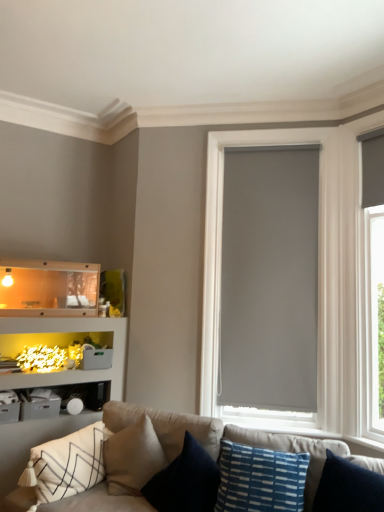
Question: Should I look upward or downward to see soft beige fabric couch at lower center?

Choices:
 (A) up
 (B) down

Answer: (B)

Question: Would you say dark blue textured pillow at center, positioned as the 2th pillow in left-to-right order, is a long distance from white textured pillow at lower left, positioned as the 3th pillow in right-to-left order?

Choices:
 (A) yes
 (B) no

Answer: (B)

Question: Considering the relative positions of dark blue textured pillow at center, positioned as the 2th pillow in left-to-right order, and white textured pillow at lower left, positioned as the 3th pillow in right-to-left order, in the image provided, is dark blue textured pillow at center, positioned as the 2th pillow in left-to-right order, to the right of white textured pillow at lower left, positioned as the 3th pillow in right-to-left order, from the viewer's perspective?

Choices:
 (A) no
 (B) yes

Answer: (B)

Question: Can you confirm if dark blue textured pillow at center, positioned as the 2th pillow in left-to-right order, is shorter than white textured pillow at lower left, which is counted as the first pillow, starting from the left?

Choices:
 (A) no
 (B) yes

Answer: (A)

Question: Is dark blue textured pillow at center, which is counted as the second pillow, starting from the right, at the left side of white textured pillow at lower left, positioned as the 3th pillow in right-to-left order?

Choices:
 (A) yes
 (B) no

Answer: (B)

Question: From a real-world perspective, is dark blue textured pillow at center, which is counted as the second pillow, starting from the right, on top of white textured pillow at lower left, positioned as the 3th pillow in right-to-left order?

Choices:
 (A) no
 (B) yes

Answer: (B)

Question: Is the position of dark blue textured pillow at center, positioned as the 2th pillow in left-to-right order, less distant than that of white textured pillow at lower left, positioned as the 3th pillow in right-to-left order?

Choices:
 (A) yes
 (B) no

Answer: (A)

Question: Does translucent plastic shelf at lower left turn towards white textured pillow at lower left, which is counted as the first pillow, starting from the left?

Choices:
 (A) yes
 (B) no

Answer: (B)

Question: Does translucent plastic shelf at lower left touch white textured pillow at lower left, positioned as the 3th pillow in right-to-left order?

Choices:
 (A) yes
 (B) no

Answer: (B)

Question: Does translucent plastic shelf at lower left have a lesser width compared to white textured pillow at lower left, positioned as the 3th pillow in right-to-left order?

Choices:
 (A) no
 (B) yes

Answer: (B)

Question: Is translucent plastic shelf at lower left taller than white textured pillow at lower left, which is counted as the first pillow, starting from the left?

Choices:
 (A) yes
 (B) no

Answer: (B)

Question: Can you confirm if translucent plastic shelf at lower left is positioned to the left of white textured pillow at lower left, positioned as the 3th pillow in right-to-left order?

Choices:
 (A) yes
 (B) no

Answer: (A)

Question: Is translucent plastic shelf at lower left located outside white textured pillow at lower left, positioned as the 3th pillow in right-to-left order?

Choices:
 (A) no
 (B) yes

Answer: (B)

Question: Is matte gray roller shade at center positioned with its back to blue textured pillow at lower center, which is the third pillow in left-to-right order?

Choices:
 (A) no
 (B) yes

Answer: (A)